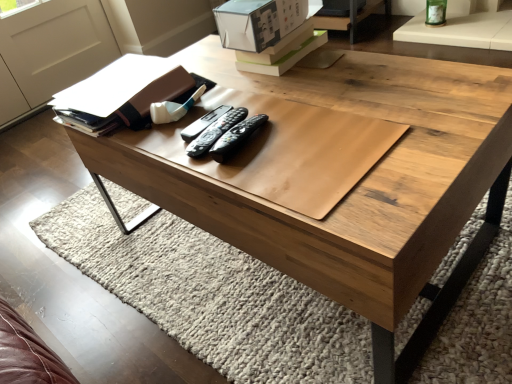
The image size is (512, 384). I want to click on free spot in front of black plastic remote at center, the 3th remote when ordered from left to right, so click(x=277, y=178).